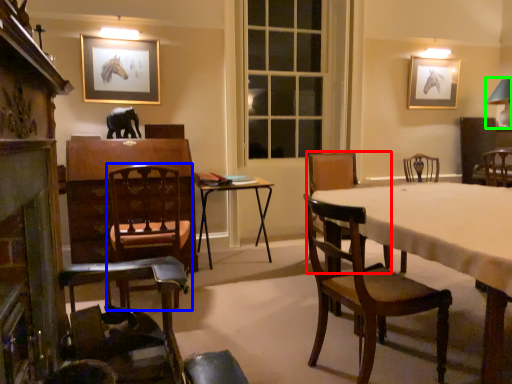
Question: Which object is the farthest from chair (highlighted by a red box)? Choose among these: chair (highlighted by a blue box) or table lamp (highlighted by a green box).

Choices:
 (A) chair
 (B) table lamp

Answer: (B)